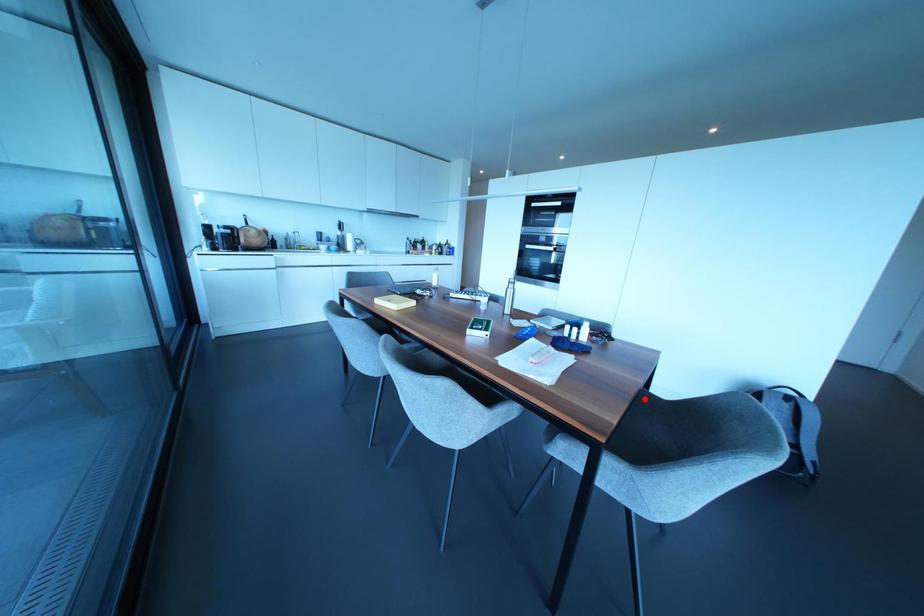
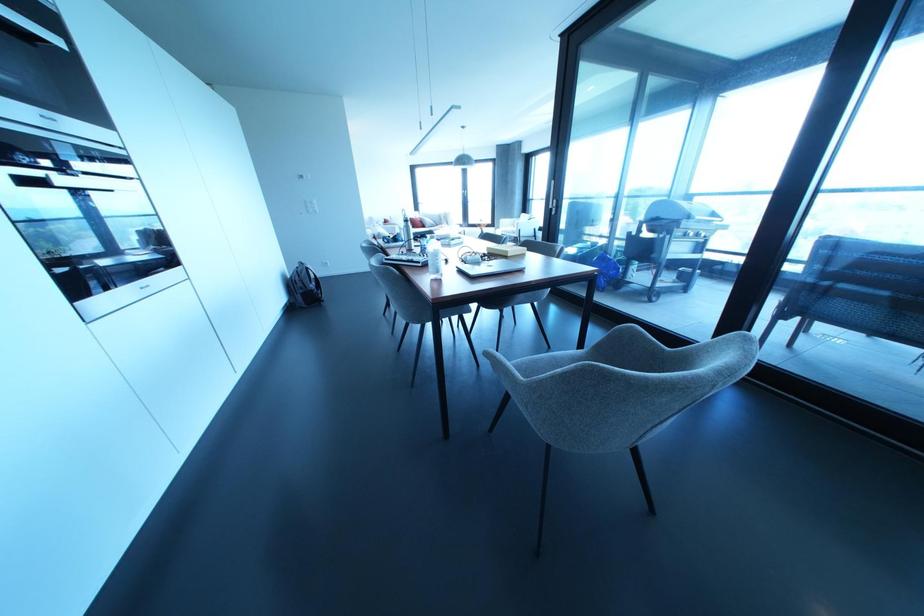
Question: I am providing you with two images of the same scene from different viewpoints. A red point is marked on the first image. Can you still see the location of the red point in image 2?

Choices:
 (A) Yes
 (B) No

Answer: (B)